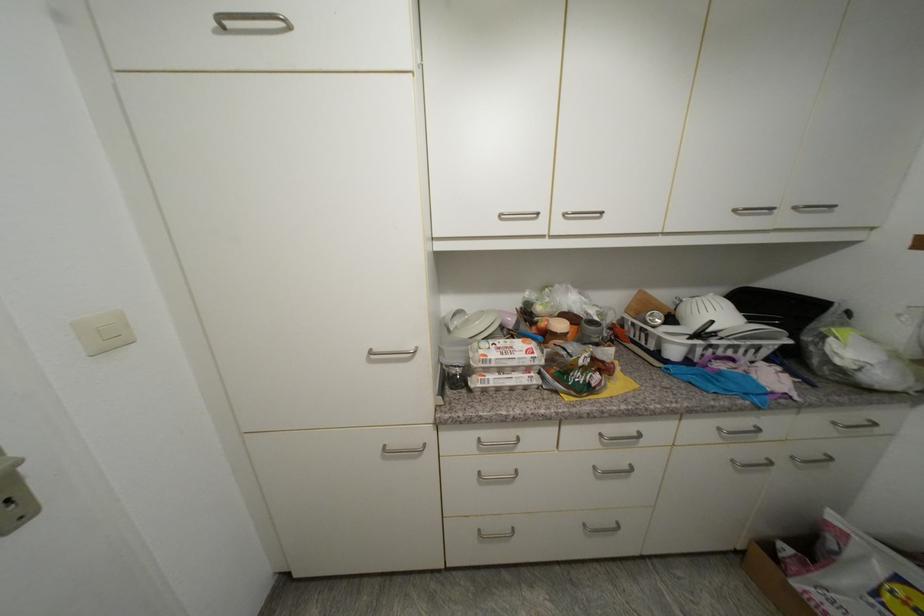
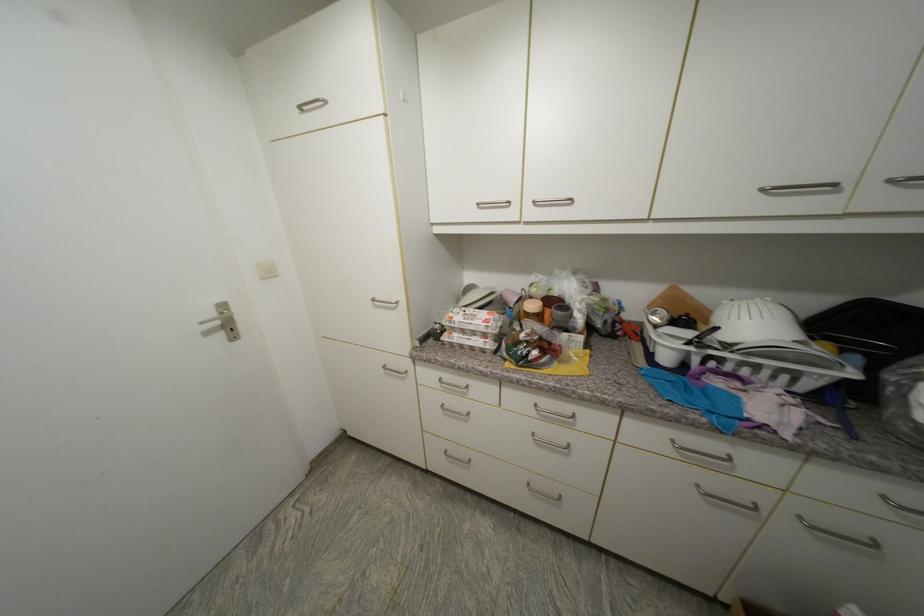
In the second image, find the point that corresponds to point (570, 216) in the first image.

(540, 204)